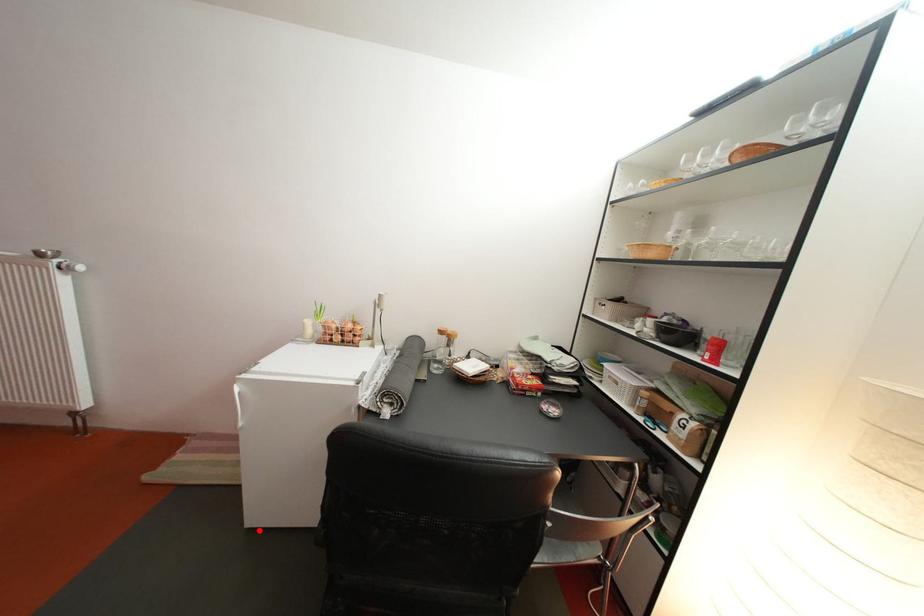
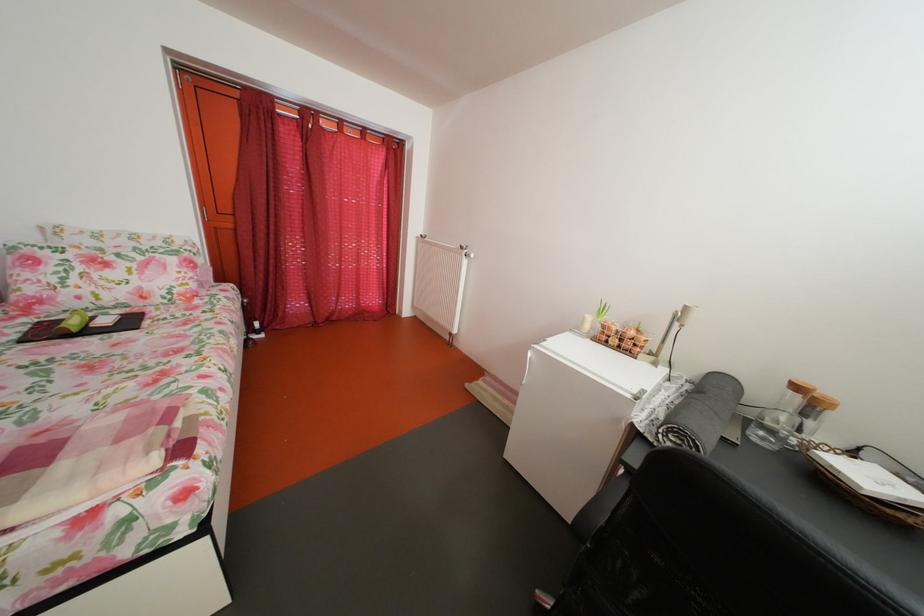
The point at the highlighted location is marked in the first image. Where is the corresponding point in the second image?

(517, 463)